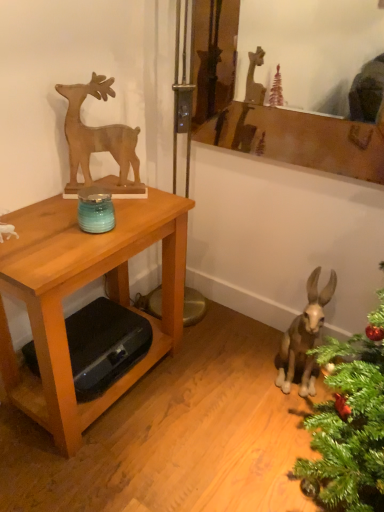
This screenshot has width=384, height=512. What are the coordinates of `vacant area that lies between wooden table at left and brown matte donkey at lower right` in the screenshot? It's located at pos(202,398).